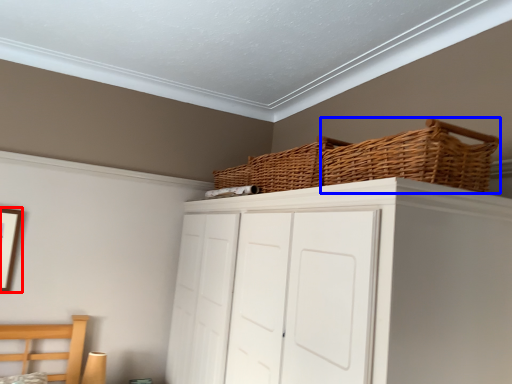
Question: Among these objects, which one is nearest to the camera, picture frame (highlighted by a red box) or basket (highlighted by a blue box)?

Choices:
 (A) picture frame
 (B) basket

Answer: (B)